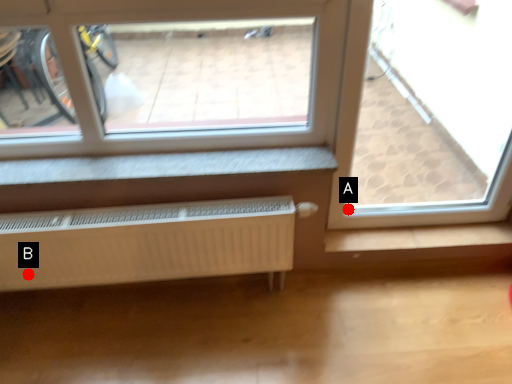
Question: Two points are circled on the image, labeled by A and B beside each circle. Which of the following is the closest to the observer?

Choices:
 (A) A is closer
 (B) B is closer

Answer: (B)